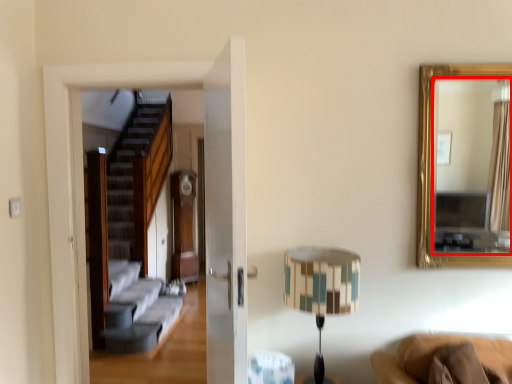
Question: Where is mirror (annotated by the red box) located in relation to table lamp in the image?

Choices:
 (A) left
 (B) right

Answer: (B)